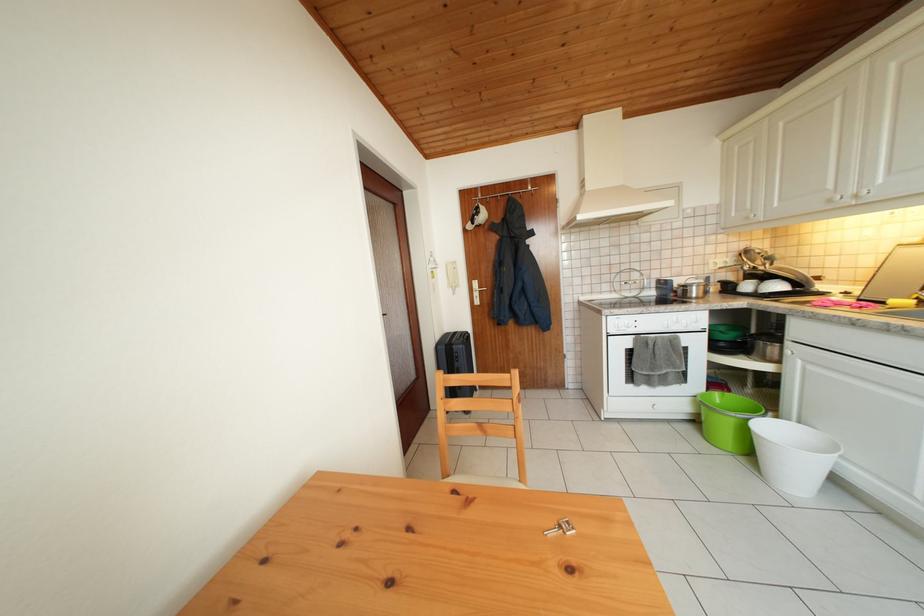
Describe the element at coordinates (793, 455) in the screenshot. I see `the white plastic bin` at that location.